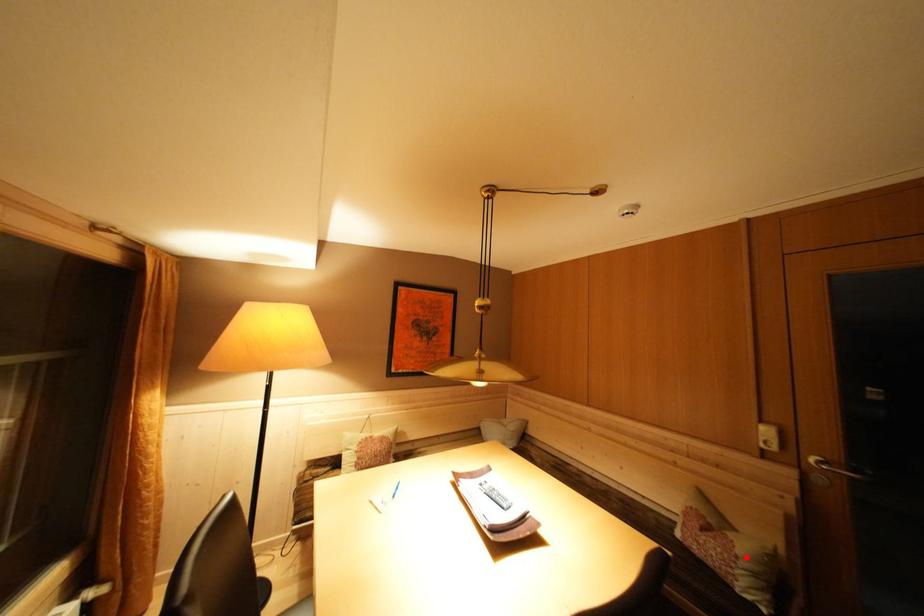
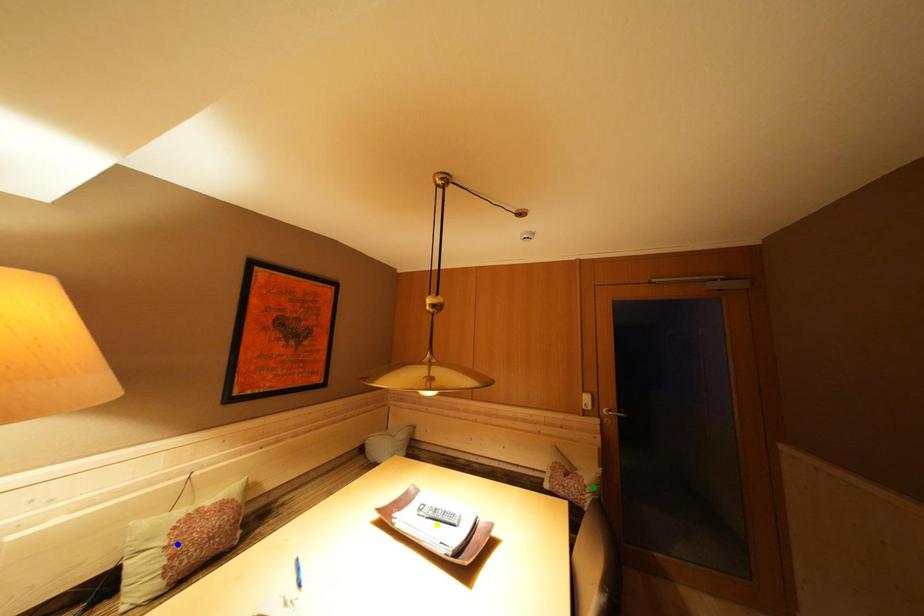
Question: I am providing you with two images of the same scene from different viewpoints. A red point is marked on the first image. You are given multiple points on the second image. Which point in image 2 is actually the same real-world point as the red point in image 1?

Choices:
 (A) yellow point
 (B) green point
 (C) blue point

Answer: (B)